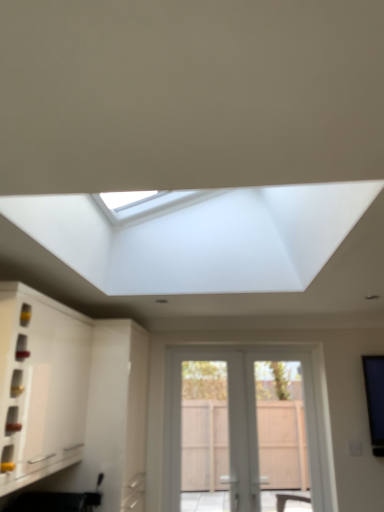
Question: Is white wooden door at center positioned with its back to white matte cabinet at left?

Choices:
 (A) yes
 (B) no

Answer: (B)

Question: Is white wooden door at center in contact with white matte cabinet at left?

Choices:
 (A) no
 (B) yes

Answer: (A)

Question: From a real-world perspective, is white wooden door at center physically below white matte cabinet at left?

Choices:
 (A) yes
 (B) no

Answer: (A)

Question: Can you confirm if white wooden door at center is positioned to the right of white matte cabinet at left?

Choices:
 (A) yes
 (B) no

Answer: (A)

Question: Is white wooden door at center further to camera compared to white matte cabinet at left?

Choices:
 (A) no
 (B) yes

Answer: (B)

Question: Are white wooden door at center and white matte cabinet at left far apart?

Choices:
 (A) no
 (B) yes

Answer: (B)

Question: Is white matte cabinet at left positioned in front of white wooden door at center?

Choices:
 (A) no
 (B) yes

Answer: (B)

Question: Is white matte cabinet at left not near white wooden door at center?

Choices:
 (A) no
 (B) yes

Answer: (B)

Question: Is white matte cabinet at left at the right side of white wooden door at center?

Choices:
 (A) yes
 (B) no

Answer: (B)

Question: From a real-world perspective, is white matte cabinet at left on white wooden door at center?

Choices:
 (A) yes
 (B) no

Answer: (A)

Question: Is white matte cabinet at left oriented towards white wooden door at center?

Choices:
 (A) yes
 (B) no

Answer: (B)

Question: Is white matte cabinet at left bigger than white wooden door at center?

Choices:
 (A) no
 (B) yes

Answer: (B)

Question: From a real-world perspective, relative to white matte cabinet at left, is white wooden door at center vertically above or below?

Choices:
 (A) below
 (B) above

Answer: (A)